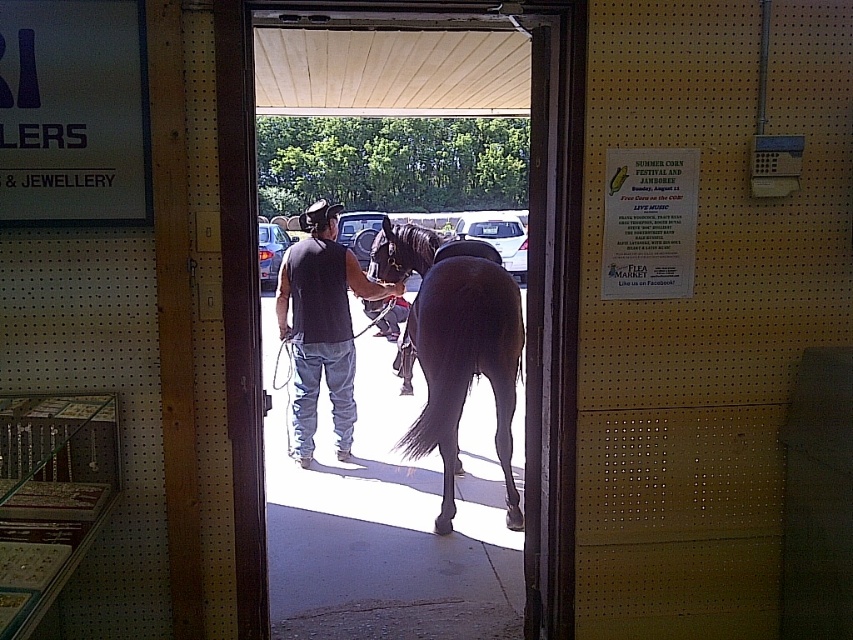
You are standing at the point labeled point at (547, 564). You want to walk to the entrance of the jewelry store. Is the entrance to the jewelry store located to your left or right side?

The entrance to the jewelry store is located to your right side because the point at (547, 564) is 8.62 feet away from the entrance, which is on the right side of the doorway.

You are a customer entering the jewelry store through the doorway. You see a brown glossy horse at center and a dark gray shirt at center. Which object is wider from your perspective?

The brown glossy horse at center is wider than the dark gray shirt at center.

You are a delivery person carrying a package that is 1.2 meters wide. You need to enter the jewelry store through the wooden door at center. However, there is a brown glossy horse at center in your way. Can you pass through the door with your package?

The wooden door at center is wider than the brown glossy horse at center, so the package can pass through the door as long as it is centered and avoids the horse.